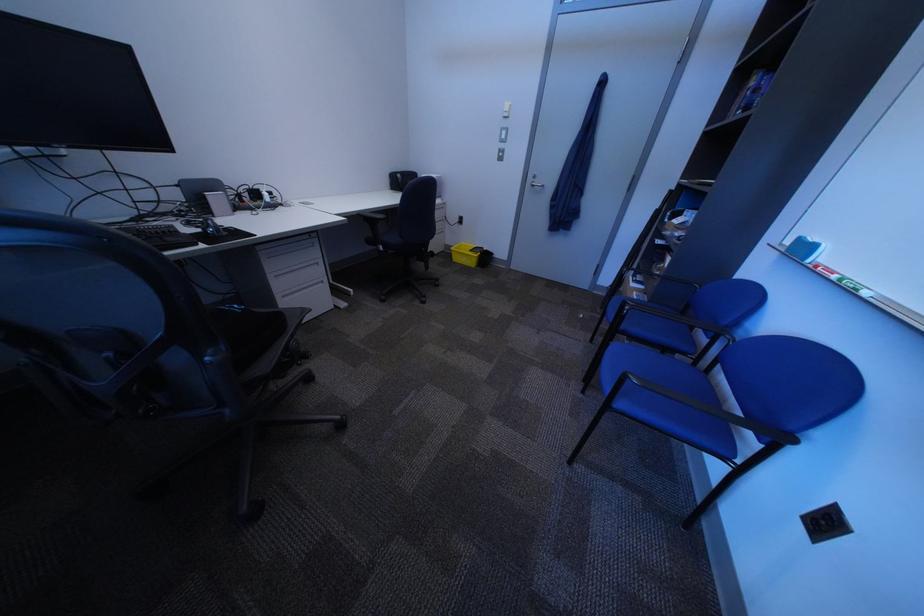
What do you see at coordinates (244, 330) in the screenshot?
I see `a black chair sitting surface` at bounding box center [244, 330].